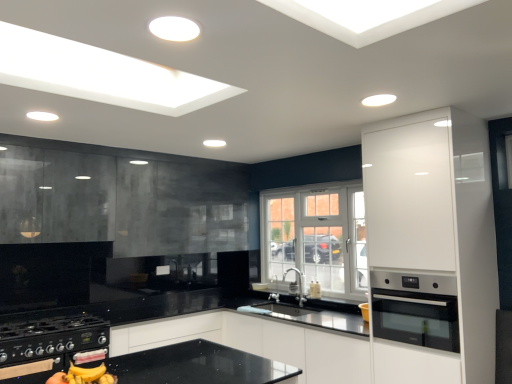
Question: Considering the positions of point (1, 354) and point (54, 163), is point (1, 354) closer or farther from the camera than point (54, 163)?

Choices:
 (A) closer
 (B) farther

Answer: (A)

Question: In terms of size, does black matte gas stove at lower left appear bigger or smaller than black glass cabinet at upper left, acting as the second cabinetry starting from the right?

Choices:
 (A) big
 (B) small

Answer: (B)

Question: Which is nearer to the black glass cabinet at upper left, which is the first cabinetry from back to front?

Choices:
 (A) satin nickel faucet at center
 (B) white glossy cabinet at right, acting as the first cabinetry starting from the right
 (C) white textured window at center
 (D) stainless steel oven at right
 (E) black matte gas stove at lower left

Answer: (E)

Question: Estimate the real-world distances between objects in this image. Which object is closer to the white textured window at center?

Choices:
 (A) black glass cabinet at upper left, the 2th cabinetry from the front
 (B) black matte gas stove at lower left
 (C) satin nickel faucet at center
 (D) white glossy cabinet at right, acting as the first cabinetry starting from the right
 (E) stainless steel oven at right

Answer: (C)